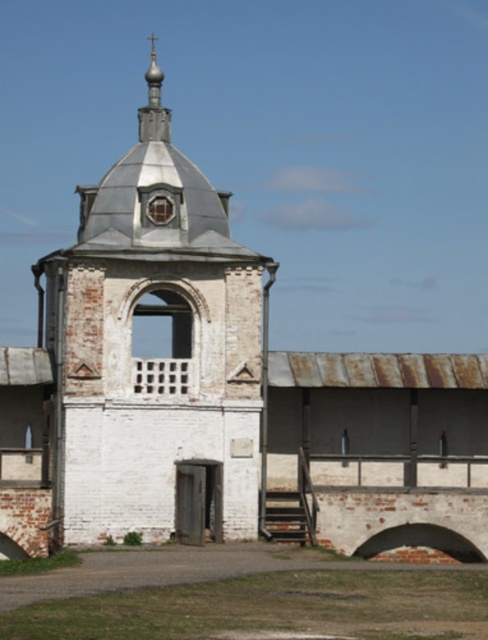
Question: Can you confirm if white painted brick tower at center is smaller than gold textured dome at upper center?

Choices:
 (A) yes
 (B) no

Answer: (A)

Question: Which point appears closest to the camera in this image?

Choices:
 (A) (148, 433)
 (B) (150, 81)

Answer: (A)

Question: In this image, where is white painted brick tower at center located relative to gold textured dome at upper center?

Choices:
 (A) below
 (B) above

Answer: (A)

Question: Among these objects, which one is farthest from the camera?

Choices:
 (A) gold textured dome at upper center
 (B) white painted brick tower at center

Answer: (A)

Question: Is white painted brick tower at center positioned at the back of gold textured dome at upper center?

Choices:
 (A) no
 (B) yes

Answer: (A)